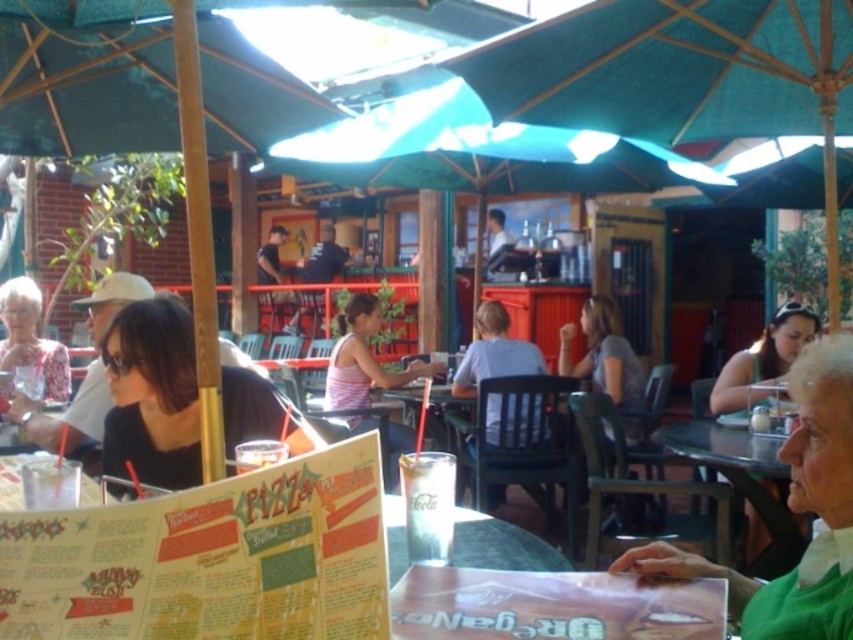
Who is positioned more to the left, teal fabric umbrella at center or matte black sunglasses at right?

From the viewer's perspective, teal fabric umbrella at center appears more on the left side.

Is teal fabric umbrella at center bigger than matte black sunglasses at right?

Indeed, teal fabric umbrella at center has a larger size compared to matte black sunglasses at right.

Between point (827, 179) and point (811, 332), which one is positioned behind?

Point (811, 332)

The width and height of the screenshot is (853, 640). What are the coordinates of `teal fabric umbrella at center` in the screenshot? It's located at (682, 76).

From the picture: Which of these two, printed paper menu at center or teal fabric umbrella at center, stands taller?

teal fabric umbrella at center

The height and width of the screenshot is (640, 853). I want to click on printed paper menu at center, so click(209, 560).

Does printed paper menu at center come behind gray fabric shirt at center?

No, printed paper menu at center is in front of gray fabric shirt at center.

Locate an element on the screen. This screenshot has width=853, height=640. printed paper menu at center is located at coordinates (209, 560).